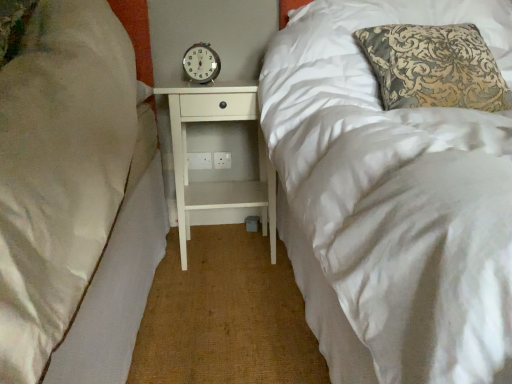
Question: Is metallic analog clock at center taller or shorter than white wood nightstand at center?

Choices:
 (A) tall
 (B) short

Answer: (B)

Question: In the image, is metallic analog clock at center on the left side or the right side of white wood nightstand at center?

Choices:
 (A) left
 (B) right

Answer: (A)

Question: In terms of size, does metallic analog clock at center appear bigger or smaller than white wood nightstand at center?

Choices:
 (A) small
 (B) big

Answer: (A)

Question: Would you say white wood nightstand at center is to the left or to the right of metallic analog clock at center in the picture?

Choices:
 (A) right
 (B) left

Answer: (A)

Question: Choose the correct answer: Is white wood nightstand at center inside metallic analog clock at center or outside it?

Choices:
 (A) inside
 (B) outside

Answer: (B)

Question: Is point (205, 188) positioned closer to the camera than point (205, 44)?

Choices:
 (A) closer
 (B) farther

Answer: (A)

Question: From a real-world perspective, is white wood nightstand at center physically located above or below metallic analog clock at center?

Choices:
 (A) below
 (B) above

Answer: (A)